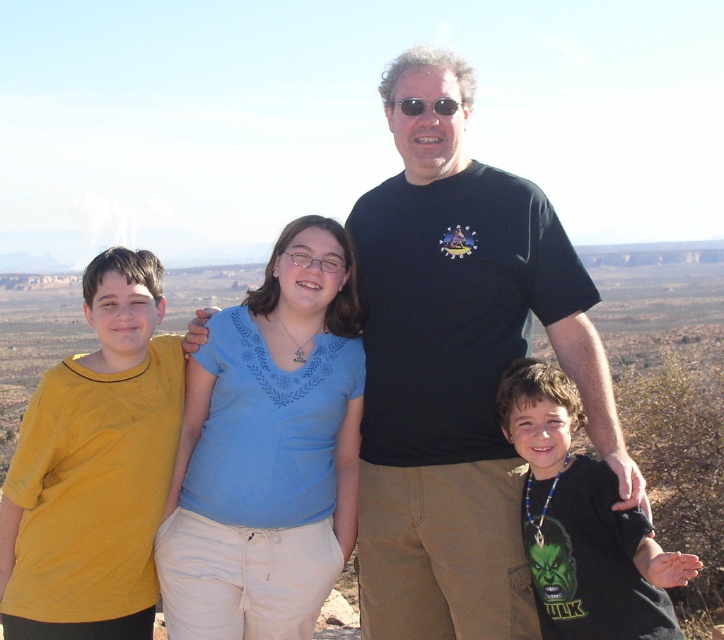
You are standing in front of the family photo. There are two points marked on the image. The first point is at coordinates point (515,513) and the second point is at point (104,608). Which point is closer to you?

Point (515,513) is closer to the viewer than point (104,608).